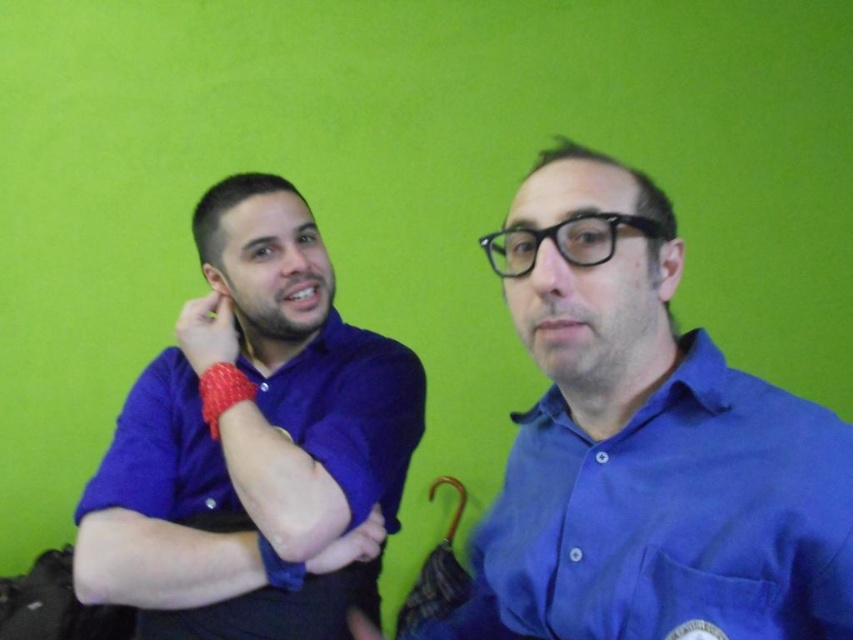
What is located at the coordinates point (648,456)?

The blue cotton shirt at center is located at point (648,456).

You are organizing a photo shoot and need to ensure that the blue cotton shirt at center and the rubber band at left are positioned correctly. Based on the scene description, which object is placed higher in the image?

The blue cotton shirt at center is located above the rubber band at left, so it is placed higher in the image.

You are a photographer setting up for a photoshoot. You need to position a camera so that both the blue cotton shirt at center and the matte blue shirt at left are visible in the frame. Based on their positions, which shirt should you focus on first to ensure both are in the shot?

The blue cotton shirt at center is located below the matte blue shirt at left, so you should focus on the matte blue shirt at left first to ensure both are in the frame.